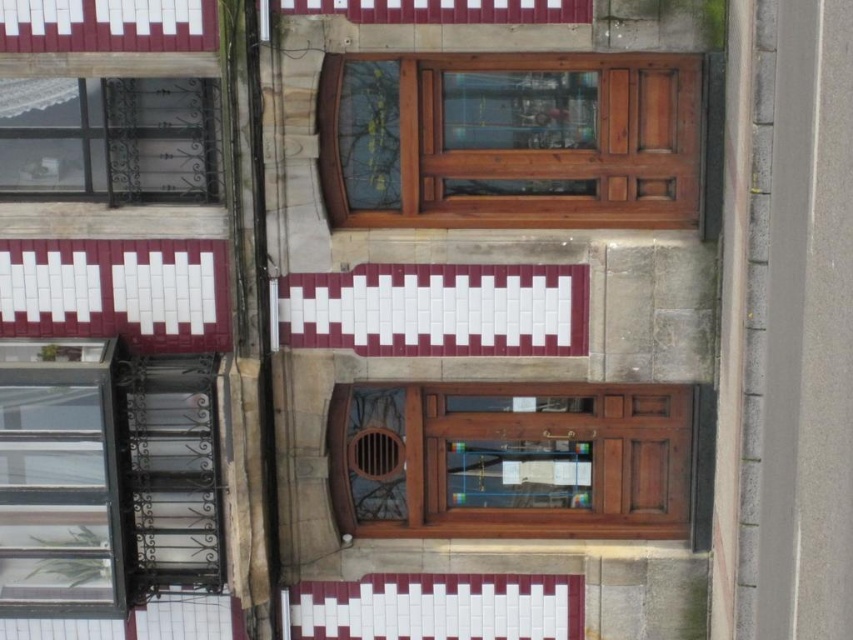
Is point (457, 72) positioned in front of point (361, 435)?

Yes, point (457, 72) is closer to viewer.

Which of these two, wooden door at center or mahogany wood window at center, stands shorter?

mahogany wood window at center is shorter.

Who is more distant from viewer, (520, 134) or (335, 508)?

Positioned behind is point (335, 508).

Where is `wooden door at center`? wooden door at center is located at coordinates (509, 140).

What do you see at coordinates (509, 140) in the screenshot?
I see `wooden door at center` at bounding box center [509, 140].

Does wooden door at center have a greater width compared to metallic wrought iron window at upper left?

Indeed, wooden door at center has a greater width compared to metallic wrought iron window at upper left.

The width and height of the screenshot is (853, 640). In order to click on wooden door at center in this screenshot , I will do `click(509, 140)`.

Who is more distant from viewer, (329, 198) or (109, 556)?

The point (109, 556) is behind.

Is wooden door at center taller than clear glass window at lower left?

Incorrect, wooden door at center's height is not larger of clear glass window at lower left's.

What do you see at coordinates (509, 140) in the screenshot? Image resolution: width=853 pixels, height=640 pixels. I see `wooden door at center` at bounding box center [509, 140].

This screenshot has width=853, height=640. Identify the location of wooden door at center. (509, 140).